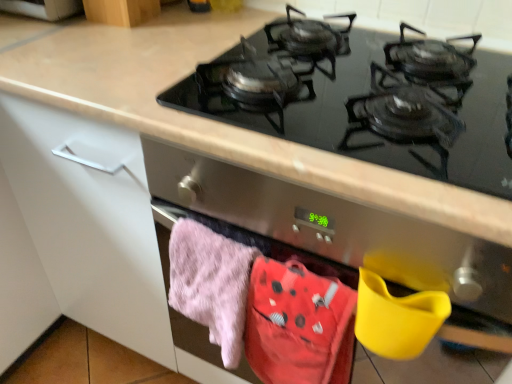
Question: Is wooden cabinet at upper left far away from black glass gas stove at upper center?

Choices:
 (A) no
 (B) yes

Answer: (A)

Question: Is wooden cabinet at upper left not within black glass gas stove at upper center?

Choices:
 (A) no
 (B) yes

Answer: (B)

Question: Is the surface of wooden cabinet at upper left in direct contact with black glass gas stove at upper center?

Choices:
 (A) yes
 (B) no

Answer: (B)

Question: Considering the relative sizes of wooden cabinet at upper left and black glass gas stove at upper center in the image provided, is wooden cabinet at upper left shorter than black glass gas stove at upper center?

Choices:
 (A) no
 (B) yes

Answer: (A)

Question: From a real-world perspective, is wooden cabinet at upper left over black glass gas stove at upper center?

Choices:
 (A) yes
 (B) no

Answer: (A)

Question: Is wooden cabinet at upper left bigger than black glass gas stove at upper center?

Choices:
 (A) yes
 (B) no

Answer: (B)

Question: Is fluffy cotton towel at lower center at the left side of black glass gas stove at upper center?

Choices:
 (A) yes
 (B) no

Answer: (A)

Question: From the image's perspective, is fluffy cotton towel at lower center below black glass gas stove at upper center?

Choices:
 (A) no
 (B) yes

Answer: (B)

Question: Does fluffy cotton towel at lower center turn towards black glass gas stove at upper center?

Choices:
 (A) no
 (B) yes

Answer: (A)

Question: Considering the relative sizes of fluffy cotton towel at lower center and black glass gas stove at upper center in the image provided, is fluffy cotton towel at lower center wider than black glass gas stove at upper center?

Choices:
 (A) yes
 (B) no

Answer: (B)

Question: Can you confirm if fluffy cotton towel at lower center is smaller than black glass gas stove at upper center?

Choices:
 (A) no
 (B) yes

Answer: (B)

Question: Is fluffy cotton towel at lower center positioned before black glass gas stove at upper center?

Choices:
 (A) yes
 (B) no

Answer: (B)

Question: Is black glass gas stove at upper center further to the viewer compared to fluffy pink towel at lower left?

Choices:
 (A) no
 (B) yes

Answer: (A)